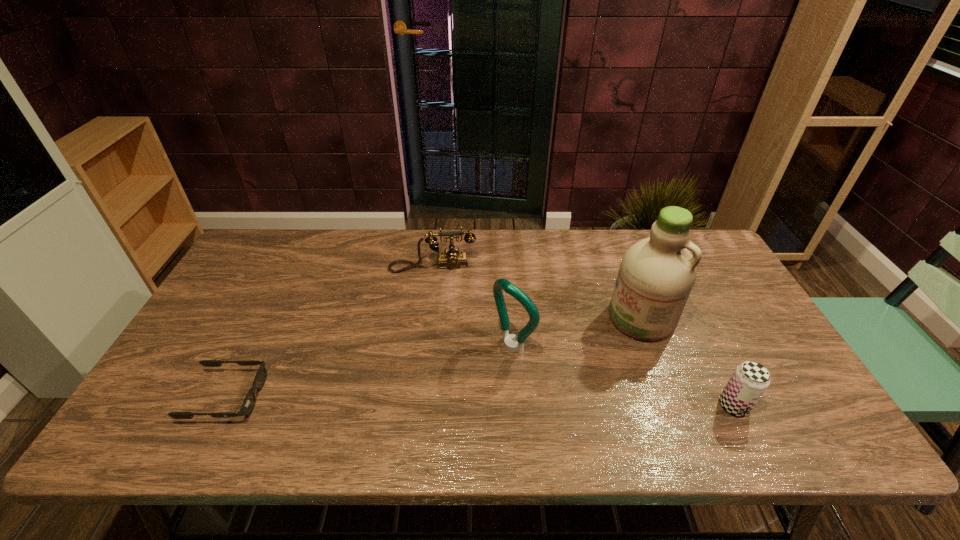
Where is `object situated at the far edge`? object situated at the far edge is located at coordinates (452, 259).

The image size is (960, 540). I want to click on sunglasses at the near edge, so click(x=248, y=404).

Locate an element on the screen. This screenshot has width=960, height=540. beer can that is at the near edge is located at coordinates (750, 379).

This screenshot has width=960, height=540. I want to click on object that is at the left edge, so click(x=248, y=404).

Where is `object that is at the right edge`? This screenshot has height=540, width=960. object that is at the right edge is located at coordinates (750, 379).

This screenshot has width=960, height=540. I want to click on object that is at the near left corner, so click(x=248, y=404).

Find the location of a particular element. The width and height of the screenshot is (960, 540). object that is positioned at the near right corner is located at coordinates (750, 379).

Image resolution: width=960 pixels, height=540 pixels. I want to click on blank area at the far edge, so click(443, 243).

Identify the location of blank space at the near edge. (621, 404).

Where is `free location at the left edge`? Image resolution: width=960 pixels, height=540 pixels. free location at the left edge is located at coordinates click(242, 278).